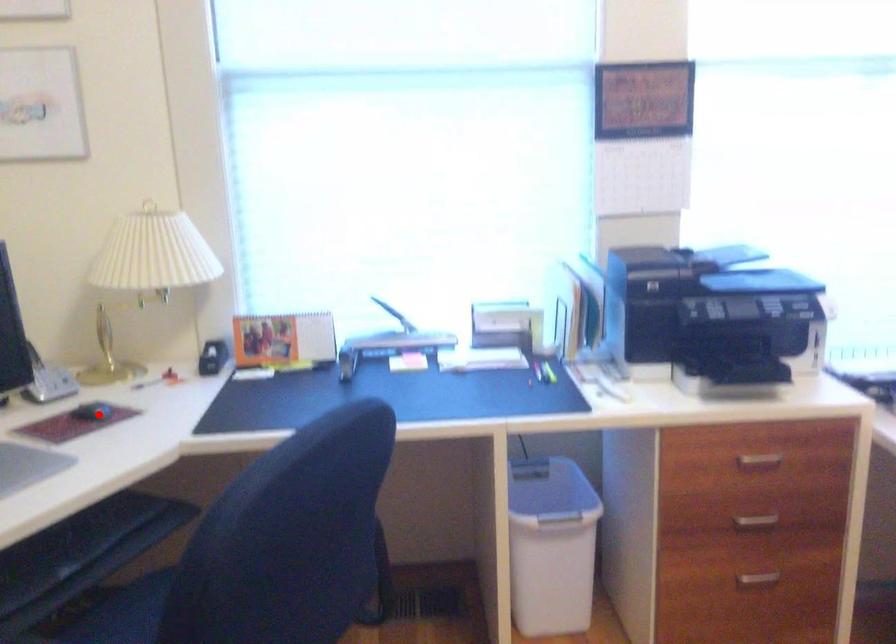
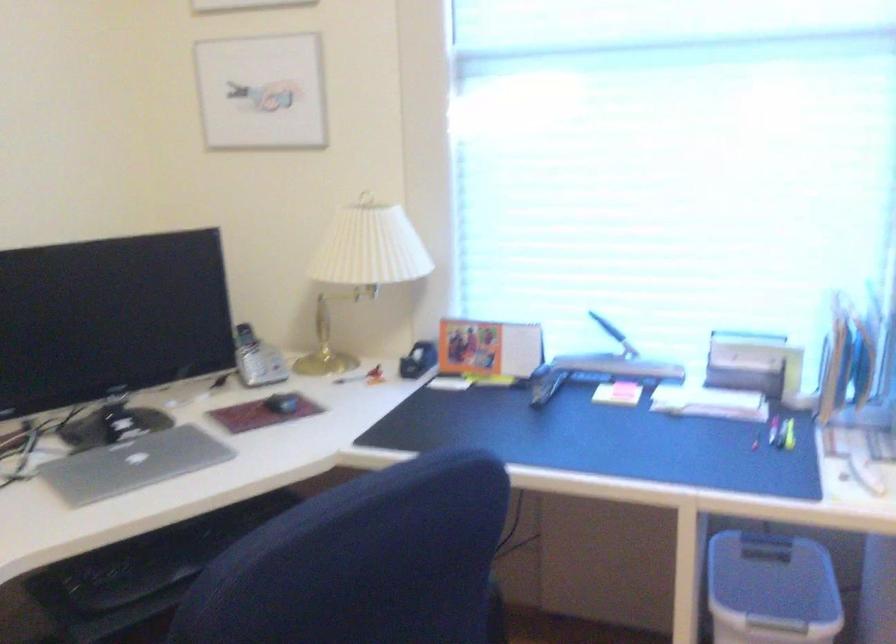
In the second image, find the point that corresponds to the highlighted location in the first image.

(281, 402)